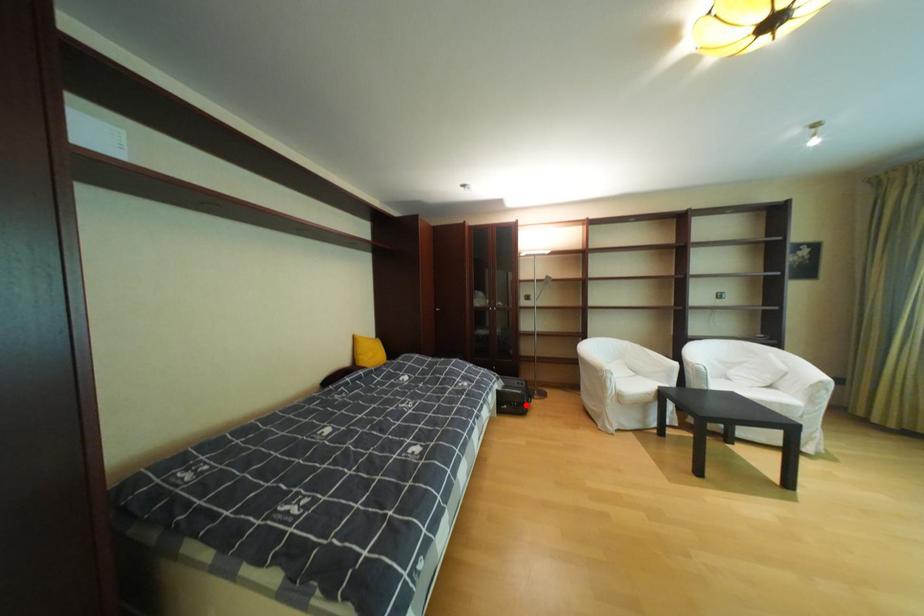
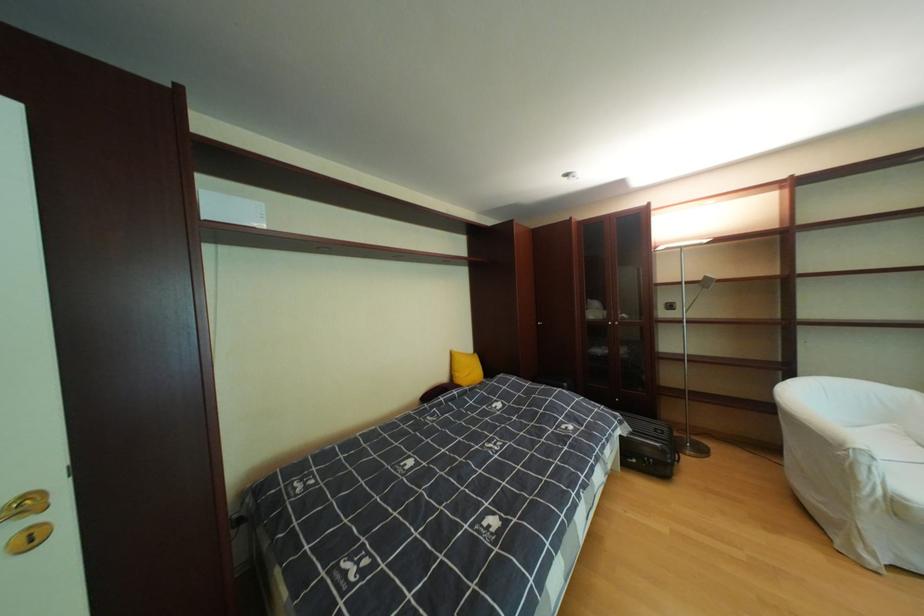
Locate, in the second image, the point that corresponds to the highlighted location in the first image.

(661, 461)